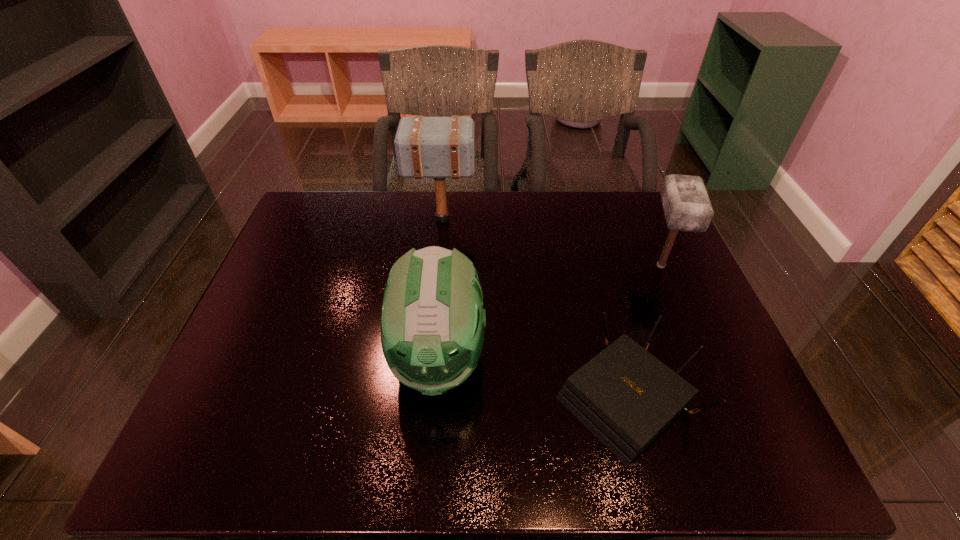
Where is `object that is the second closest to the shortest object`? object that is the second closest to the shortest object is located at coordinates (686, 204).

The height and width of the screenshot is (540, 960). What are the coordinates of `free space that satisfies the following two spatial constraints: 1. on the striking surface of the nearer mallet; 2. on the left side of the farthest object` in the screenshot? It's located at (438, 266).

Locate an element on the screen. The image size is (960, 540). free space that satisfies the following two spatial constraints: 1. on the striking surface of the farther mallet; 2. on the left side of the nearer mallet is located at coordinates (438, 266).

What are the coordinates of `free point that satisfies the following two spatial constraints: 1. on the visor of the shortest object; 2. on the right side of the football helmet` in the screenshot? It's located at (435, 397).

You are a GUI agent. You are given a task and a screenshot of the screen. Output one action in this format:
    pyautogui.click(x=<x>, y=<y>)
    Task: Click on the vacant space that satisfies the following two spatial constraints: 1. on the visor of the football helmet; 2. on the left side of the router
    
    Given the screenshot: What is the action you would take?
    pyautogui.click(x=435, y=397)

Locate an element on the screen. vacant point that satisfies the following two spatial constraints: 1. on the striking surface of the second farthest object; 2. on the left side of the farthest object is located at coordinates (438, 266).